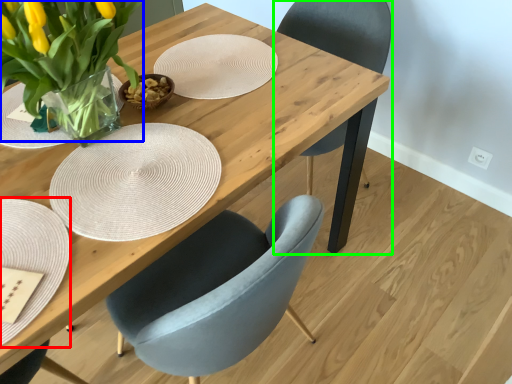
Question: Which object is positioned farthest from plate (highlighted by a red box)? Select from floral arrangement (highlighted by a blue box) and chair (highlighted by a green box).

Choices:
 (A) floral arrangement
 (B) chair

Answer: (B)